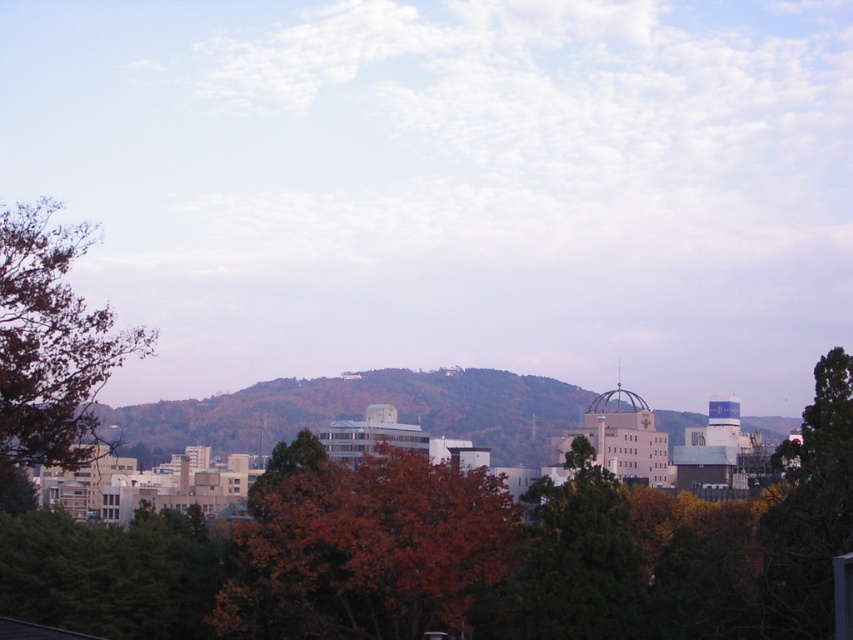
Question: Which point is farther to the camera?

Choices:
 (A) (381, 612)
 (B) (766, 518)

Answer: (A)

Question: Which object is farther from the camera taking this photo?

Choices:
 (A) green leafy hillside at center
 (B) brown leafy tree at left

Answer: (A)

Question: Can you confirm if green leafy hillside at center is positioned above brown leafy tree at left?

Choices:
 (A) no
 (B) yes

Answer: (A)

Question: Which object is closer to the camera taking this photo?

Choices:
 (A) green matte tree at center
 (B) green leafy hillside at center

Answer: (A)

Question: Is brown leafy tree at left wider than green leafy tree at right?

Choices:
 (A) yes
 (B) no

Answer: (B)

Question: Where is green leafy hillside at center located in relation to brown leafy tree at left in the image?

Choices:
 (A) above
 (B) below

Answer: (B)